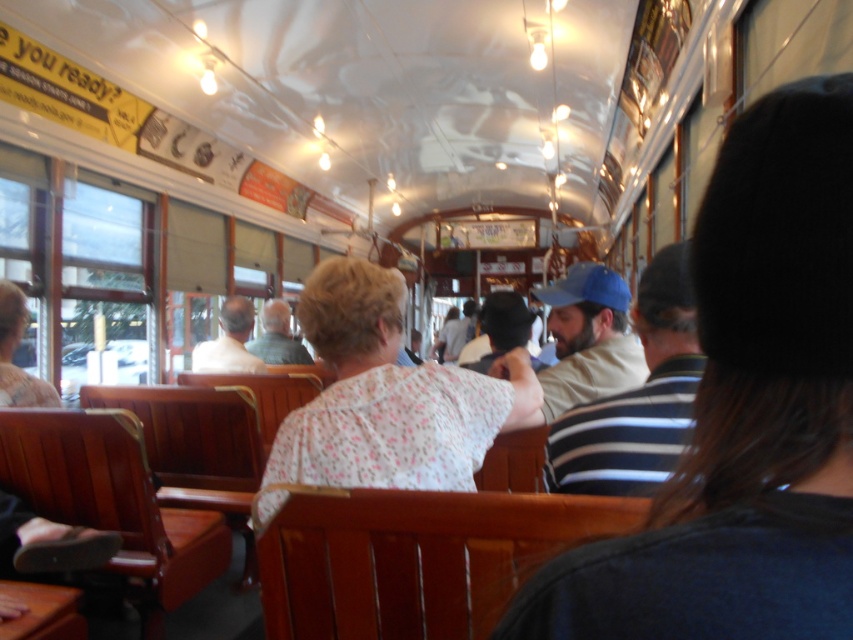
You are a passenger sitting in the tram and notice two items at the center of the scene. The striped cotton shirt at center and the blue fabric cap at center. Which one is higher from the floor?

The striped cotton shirt at center is above the blue fabric cap at center, so the striped cotton shirt at center is higher from the floor.